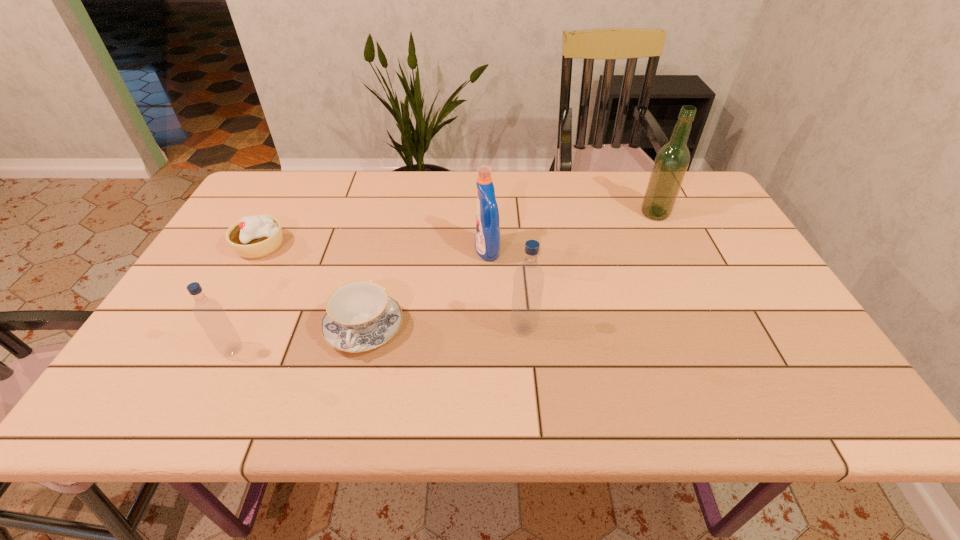
The image size is (960, 540). Find the location of `the nearer water bottle`. the nearer water bottle is located at coordinates (209, 313).

You are a GUI agent. You are given a task and a screenshot of the screen. Output one action in this format:
    pyautogui.click(x=<x>, y=<y>)
    Task: Click on the left water bottle
    The height and width of the screenshot is (540, 960).
    Given the screenshot: What is the action you would take?
    pyautogui.click(x=209, y=313)

Identify the location of the right water bottle. (528, 281).

At what (x,y) coordinates should I click in order to perform the action: click on the taller water bottle. Please return your answer as a coordinate pair (x, y). The height and width of the screenshot is (540, 960). Looking at the image, I should click on (528, 281).

Find the location of a particular element. This screenshot has height=540, width=960. liquor is located at coordinates (672, 160).

The image size is (960, 540). Identify the location of the tallest object. (672, 160).

Where is `chinaware`? The width and height of the screenshot is (960, 540). chinaware is located at coordinates click(x=360, y=316).

Locate an element on the screen. the fourth object from right to left is located at coordinates (360, 316).

You are a GUI agent. You are given a task and a screenshot of the screen. Output one action in this format:
    pyautogui.click(x=<x>, y=<y>)
    Task: Click on the detergent
    Image resolution: width=960 pixels, height=540 pixels.
    Given the screenshot: What is the action you would take?
    pyautogui.click(x=487, y=235)

At what (x,y) coordinates should I click in order to perform the action: click on whipped cream. Please return your answer as a coordinate pair (x, y). Image resolution: width=960 pixels, height=540 pixels. Looking at the image, I should click on (256, 236).